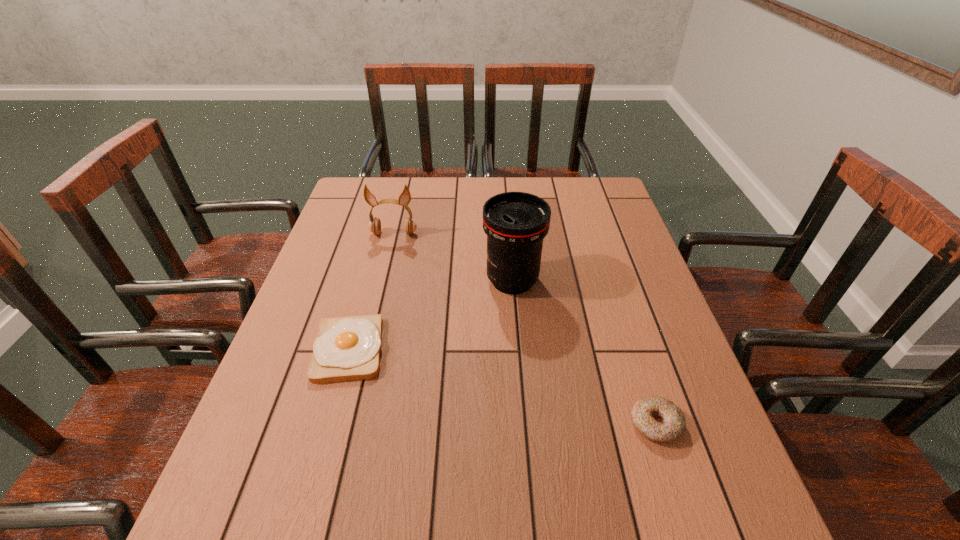
This screenshot has height=540, width=960. Identify the location of telephoto lens. (515, 223).

You are a GUI agent. You are given a task and a screenshot of the screen. Output one action in this format:
    pyautogui.click(x=<x>, y=<y>)
    Task: Click on the second farthest object
    Image resolution: width=960 pixels, height=540 pixels.
    Given the screenshot: What is the action you would take?
    pyautogui.click(x=515, y=223)

At what (x,y) coordinates should I click in order to perform the action: click on the farthest object. Please return your answer as a coordinate pair (x, y). Looking at the image, I should click on (374, 226).

Find the location of a particular element. The height and width of the screenshot is (540, 960). earphone is located at coordinates (374, 226).

The width and height of the screenshot is (960, 540). Identify the location of the nearest object. (658, 419).

This screenshot has height=540, width=960. I want to click on doughnut, so click(658, 419).

Find the location of a particular element. This screenshot has height=540, width=960. toast is located at coordinates (347, 348).

Find the location of a particular element. vacant space located on the right of the third nearest object is located at coordinates (587, 281).

Locate an element on the screen. vacant space situated on the front-facing side of the farthest object is located at coordinates (368, 341).

Find the location of `free space located 0.130m on the front of the rightmost object`. free space located 0.130m on the front of the rightmost object is located at coordinates (686, 521).